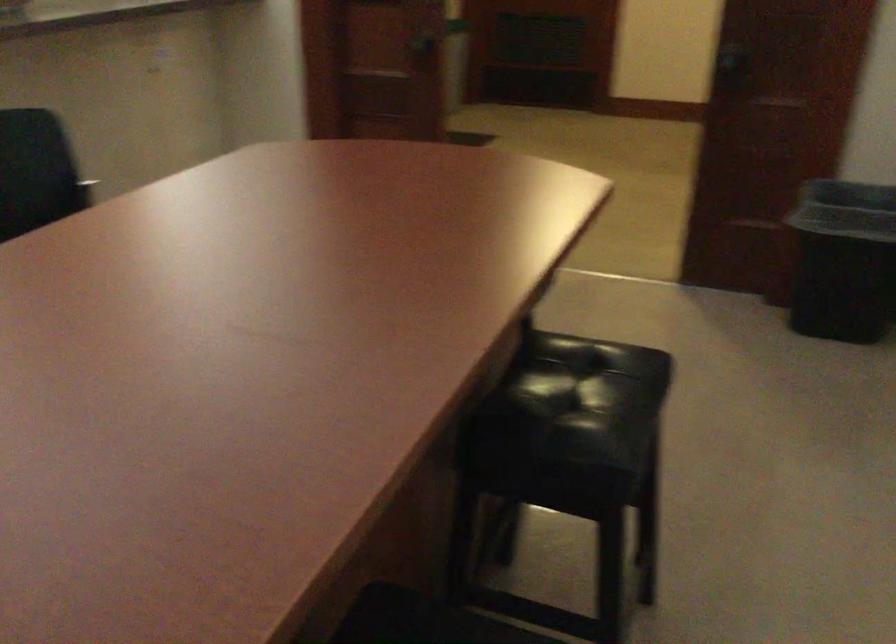
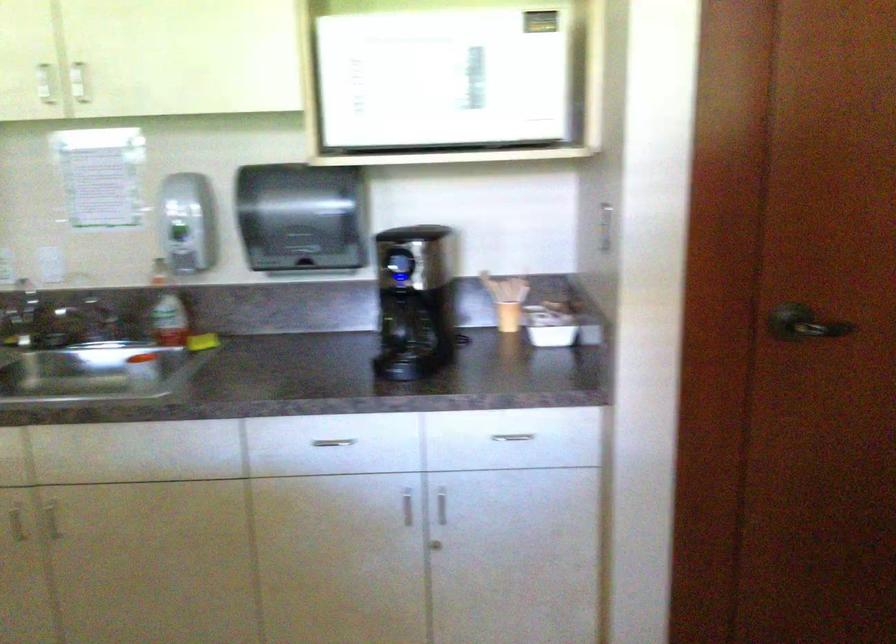
First-person continuous shooting, in which direction is the camera rotating?

The camera rotated toward right-down.